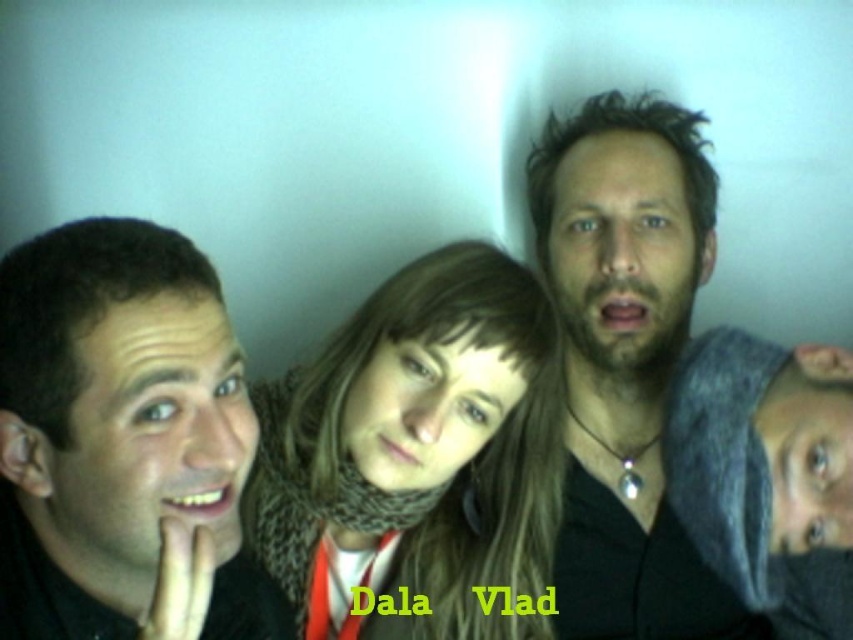
You are a photographer adjusting the camera settings to ensure all subjects are in focus. Given that the camera can only focus on objects within a 10 inch range, will the black matte face at left and the knitted scarf at center both be in focus?

The distance between the black matte face at left and the knitted scarf at center is 9.69 inches, which is within the camera focus range of 10 inches. Therefore, both subjects will be in focus.

You are standing in front of the group photo and want to touch the black matte face at left before touching the matte black shirt at center. Which one should you reach for first?

The black matte face at left is in front of the matte black shirt at center, so you should reach for the black matte face at left first.